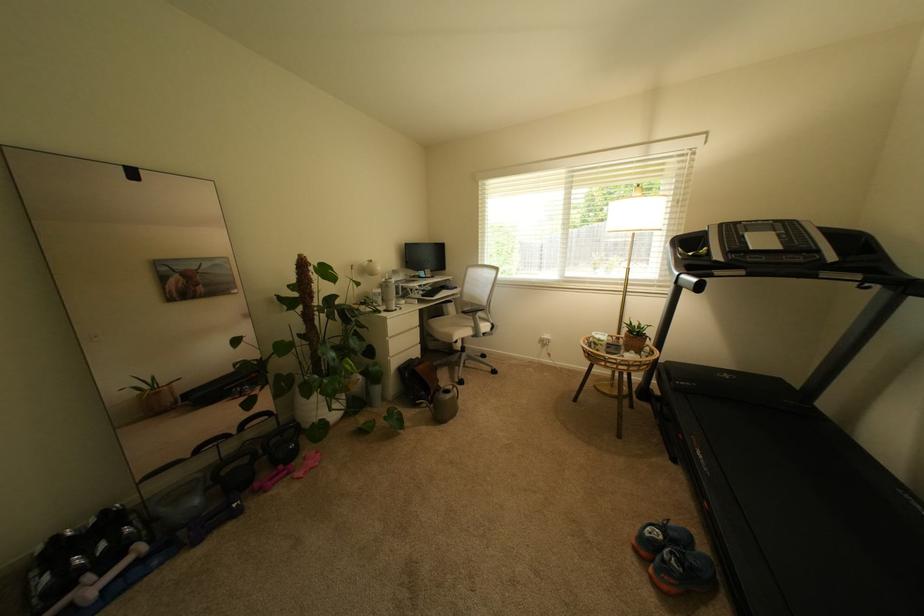
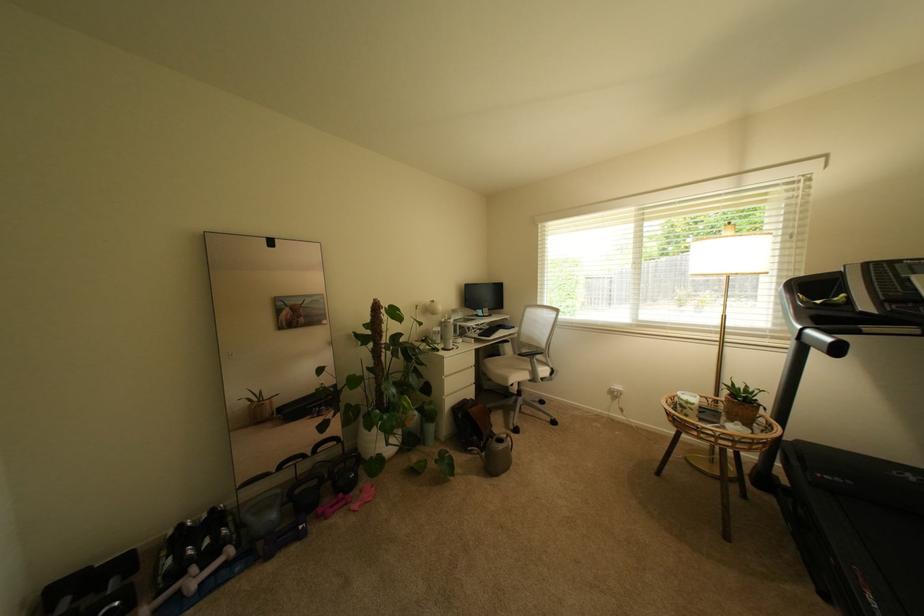
Where in the second image is the point corresponding to pixel 393 310 from the first image?

(451, 347)